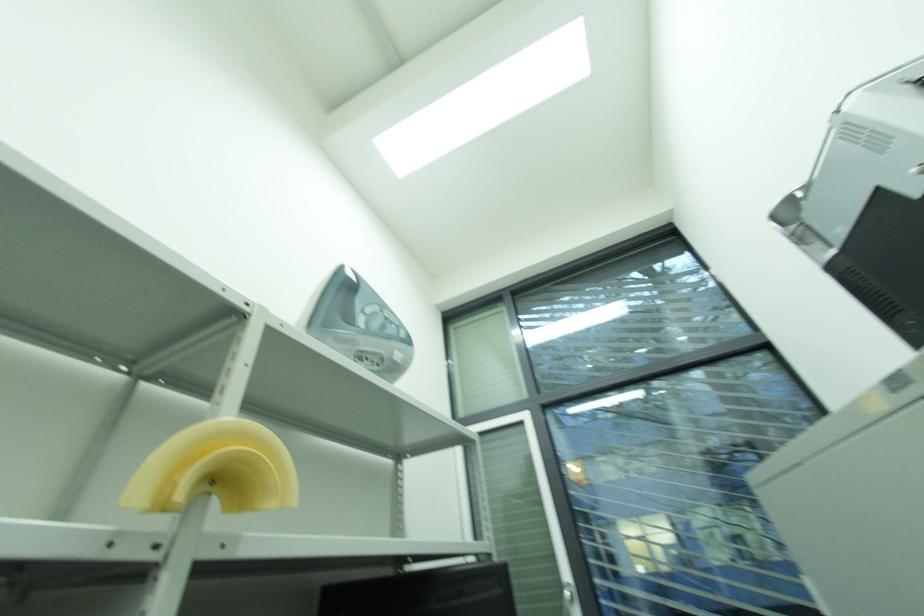
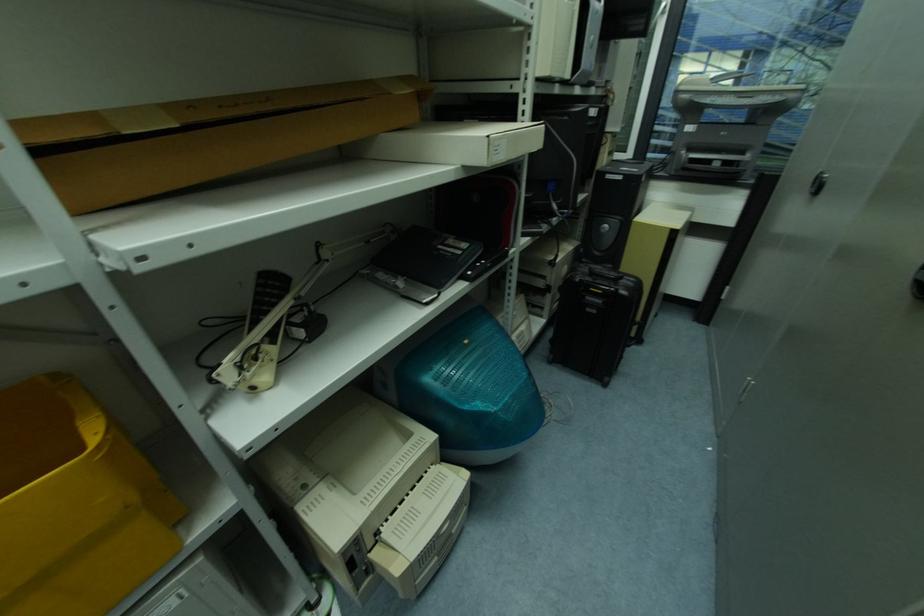
Question: Based on the continuous images, in which direction is the camera rotating? Reply with the corresponding letter.

Choices:
 (A) Left
 (B) Right
 (C) Up
 (D) Down

Answer: (D)